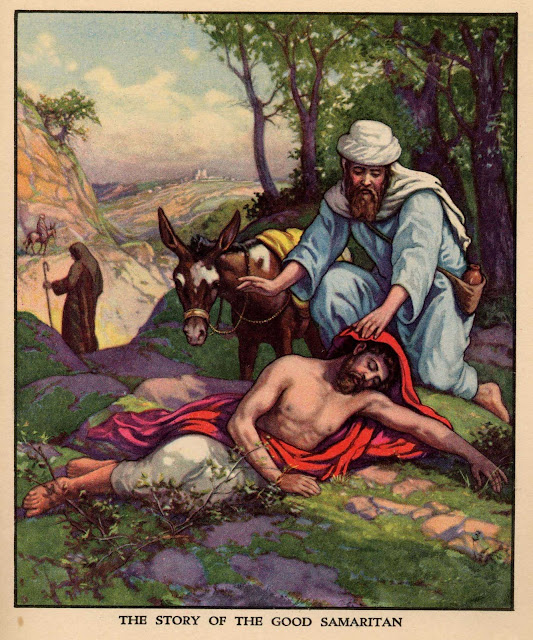
Find the location of a particular element. The width and height of the screenshot is (533, 640). red cloth is located at coordinates (330, 452).